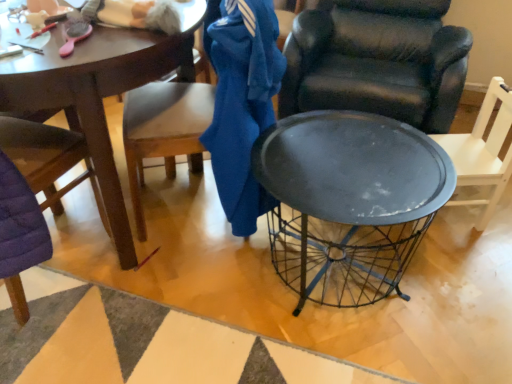
This screenshot has height=384, width=512. Identify the location of free space that is to the left of metallic black table at center. (178, 301).